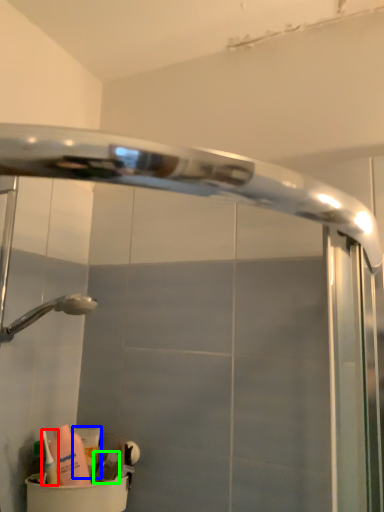
Question: Which is nearer to the cleaning product (highlighted by a red box)? cleaning product (highlighted by a blue box) or toiletry (highlighted by a green box).

Choices:
 (A) cleaning product
 (B) toiletry

Answer: (A)